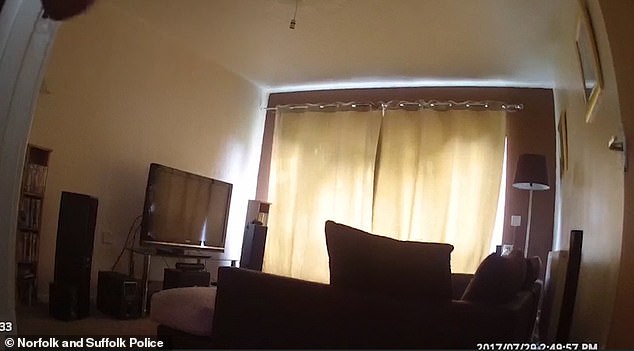
You are a GUI agent. You are given a task and a screenshot of the screen. Output one action in this format:
    pyautogui.click(x=<x>, y=<y>)
    Task: Click on the dark brown painted wall
    
    Given the screenshot: What is the action you would take?
    pyautogui.click(x=276, y=98)